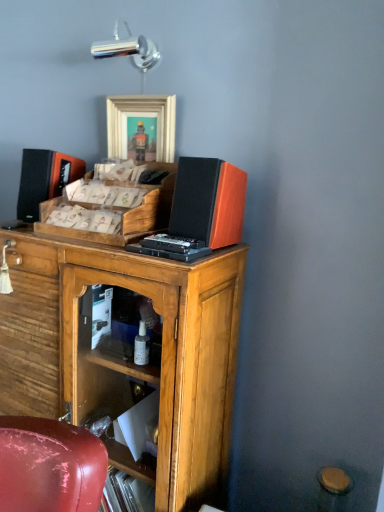
Question: Considering the relative positions of wooden cabinet at center and wooden tray at center in the image provided, is wooden cabinet at center to the right of wooden tray at center from the viewer's perspective?

Choices:
 (A) no
 (B) yes

Answer: (A)

Question: Does wooden cabinet at center lie in front of wooden tray at center?

Choices:
 (A) no
 (B) yes

Answer: (B)

Question: From a real-world perspective, is wooden cabinet at center beneath wooden tray at center?

Choices:
 (A) yes
 (B) no

Answer: (A)

Question: Could you tell me if wooden cabinet at center is facing wooden tray at center?

Choices:
 (A) no
 (B) yes

Answer: (A)

Question: From a real-world perspective, is wooden cabinet at center physically above wooden tray at center?

Choices:
 (A) no
 (B) yes

Answer: (A)

Question: Do you think wooden cabinet at center is within orange matte speaker at upper right, or outside of it?

Choices:
 (A) inside
 (B) outside

Answer: (B)

Question: In the image, is wooden cabinet at center positioned in front of or behind orange matte speaker at upper right?

Choices:
 (A) behind
 (B) front

Answer: (B)

Question: Is wooden cabinet at center bigger or smaller than orange matte speaker at upper right?

Choices:
 (A) big
 (B) small

Answer: (A)

Question: From the image's perspective, is wooden cabinet at center positioned above or below orange matte speaker at upper right?

Choices:
 (A) below
 (B) above

Answer: (A)

Question: Is wooden tray at center bigger or smaller than orange matte speaker at upper right?

Choices:
 (A) small
 (B) big

Answer: (B)

Question: From the image's perspective, relative to orange matte speaker at upper right, is wooden tray at center above or below?

Choices:
 (A) above
 (B) below

Answer: (A)

Question: In the image, is wooden tray at center positioned in front of or behind orange matte speaker at upper right?

Choices:
 (A) front
 (B) behind

Answer: (B)

Question: Would you say wooden tray at center is inside or outside orange matte speaker at upper right?

Choices:
 (A) inside
 (B) outside

Answer: (B)

Question: Looking at the image, does wooden picture frame at upper center seem bigger or smaller compared to wooden cabinet at center?

Choices:
 (A) big
 (B) small

Answer: (B)

Question: From a real-world perspective, is wooden picture frame at upper center positioned above or below wooden cabinet at center?

Choices:
 (A) above
 (B) below

Answer: (A)